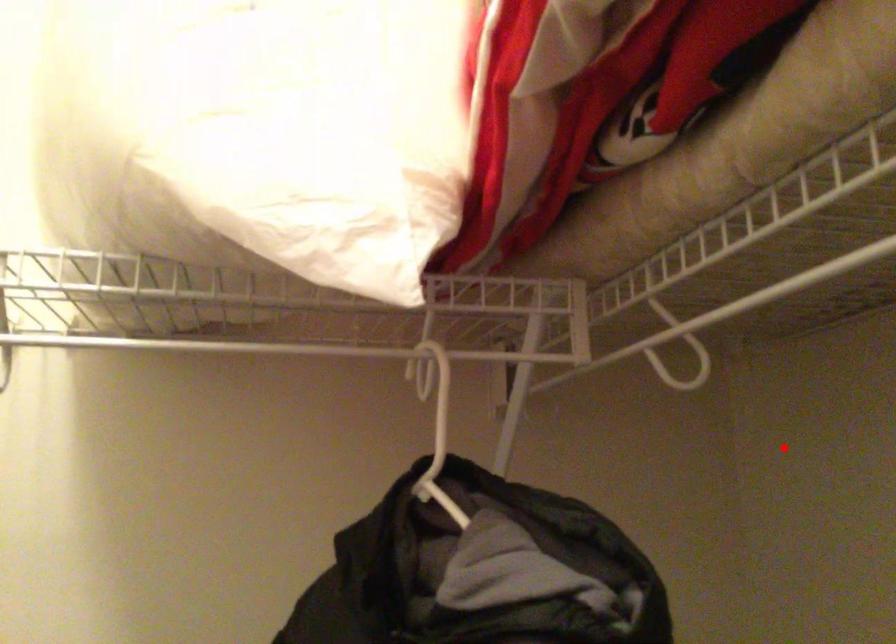
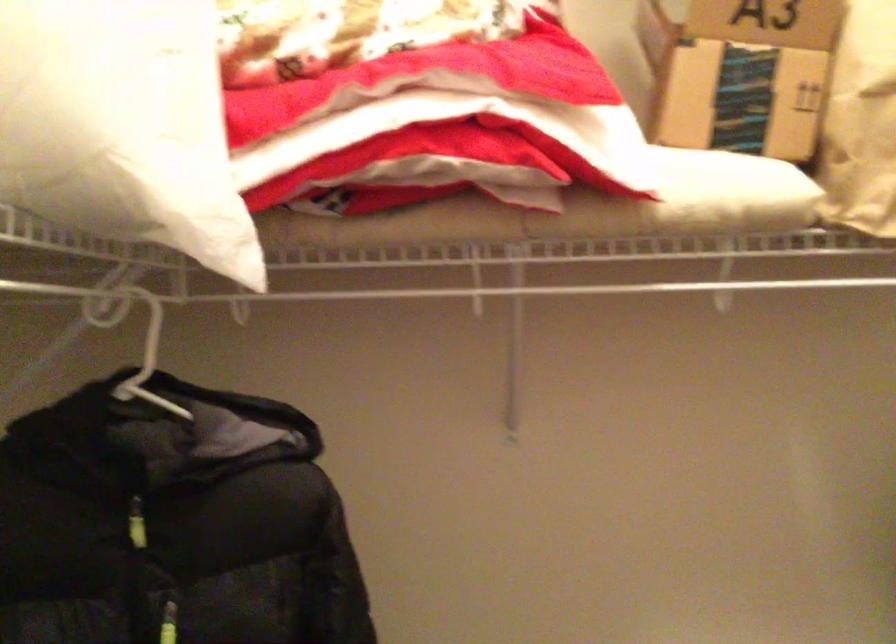
Question: I am providing you with two images of the same scene from different viewpoints. Image1 has a red point marked. In image2, the corresponding 3D location appears at what relative position? Reply with the corresponding letter.

Choices:
 (A) Closer
 (B) Farther

Answer: (B)